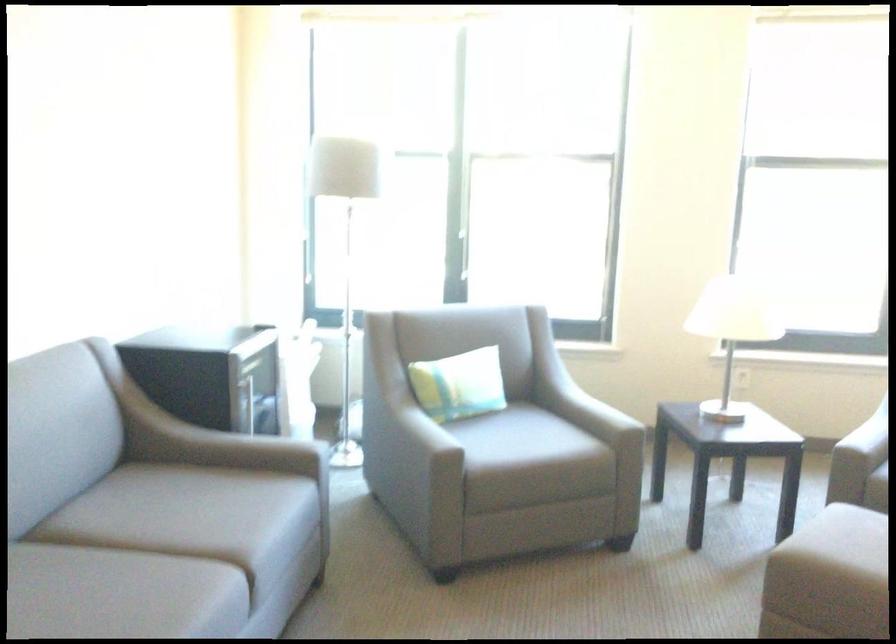
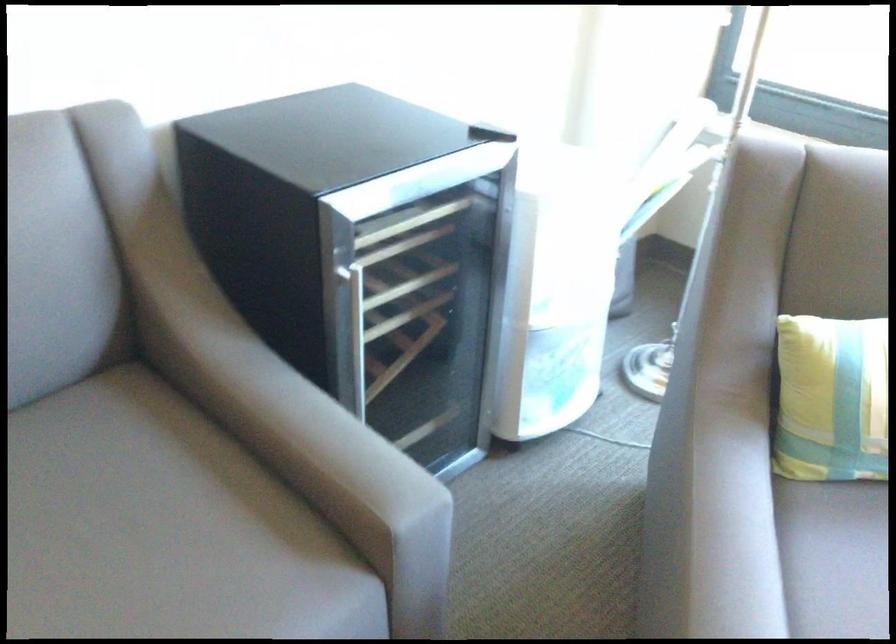
Question: I am providing you with two images of the same scene from different viewpoints. Which of the following objects are not visible in image2?

Choices:
 (A) speaker volume dial
 (B) striped small pillow
 (C) grey chair armrest
 (D) grey sofa armrest

Answer: (D)